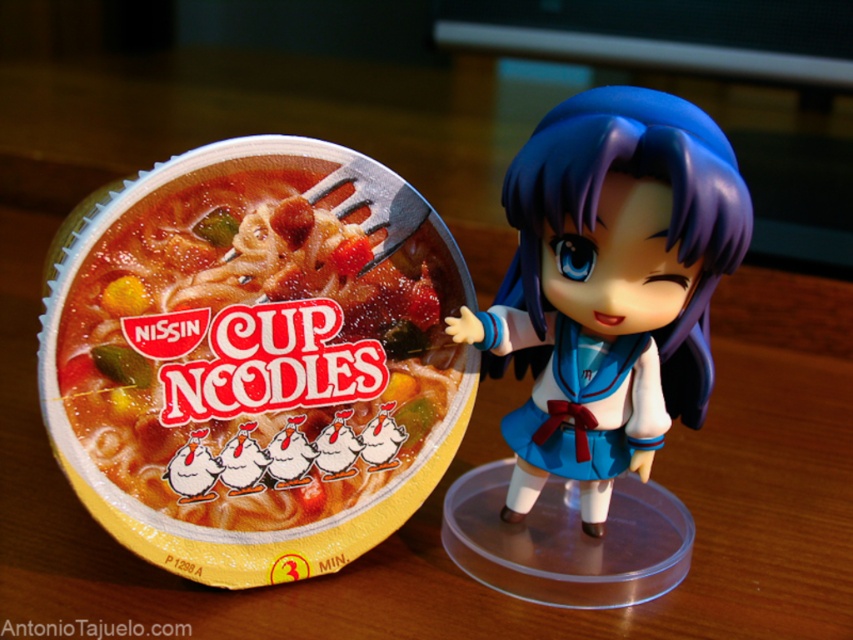
You are organizing a display at a toy store and need to place the matte plastic cup noodles at left and the satin blue doll at center on a shelf. The shelf has a height limit of 15 centimeters. Can both items fit vertically without exceeding the height limit?

The matte plastic cup noodles at left is smaller than the satin blue doll at center, but the exact heights are not provided. Therefore, it is uncertain if both items can fit vertically within the 15 cm height limit without more information.

You are organizing a display shelf and need to place the matte plastic cup noodles at left and the satin blue doll at center. Based on their positions in the image, which object should you place lower on the shelf to maintain the same arrangement?

The matte plastic cup noodles at left should be placed lower on the shelf since it is located below the satin blue doll at center in the image.

You have a storage box that can only fit items wider than 10 cm. You need to decide which of the matte plastic cup noodles at left or the satin blue doll at center can fit into the box. Which item should you choose?

The matte plastic cup noodles at left has a greater width than the satin blue doll at center. Since the box requires items wider than 10 cm, you should choose the matte plastic cup noodles at left as it is wider and more likely to meet the width requirement.